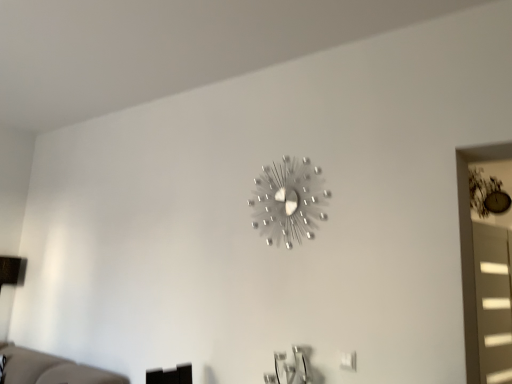
Question: Considering the positions of satin silver clock at upper center and matte gray window at right in the image, is satin silver clock at upper center wider or thinner than matte gray window at right?

Choices:
 (A) thin
 (B) wide

Answer: (A)

Question: Is satin silver clock at upper center in front of or behind matte gray window at right in the image?

Choices:
 (A) behind
 (B) front

Answer: (B)

Question: From the image's perspective, is satin silver clock at upper center positioned above or below matte gray window at right?

Choices:
 (A) above
 (B) below

Answer: (A)

Question: Is matte gray window at right situated inside satin silver clock at upper center or outside?

Choices:
 (A) inside
 (B) outside

Answer: (B)

Question: Does point (467, 211) appear closer or farther from the camera than point (301, 195)?

Choices:
 (A) farther
 (B) closer

Answer: (B)

Question: Considering the positions of matte gray window at right and satin silver clock at upper center in the image, is matte gray window at right wider or thinner than satin silver clock at upper center?

Choices:
 (A) wide
 (B) thin

Answer: (A)

Question: Based on their positions, is matte gray window at right located to the left or right of satin silver clock at upper center?

Choices:
 (A) right
 (B) left

Answer: (A)